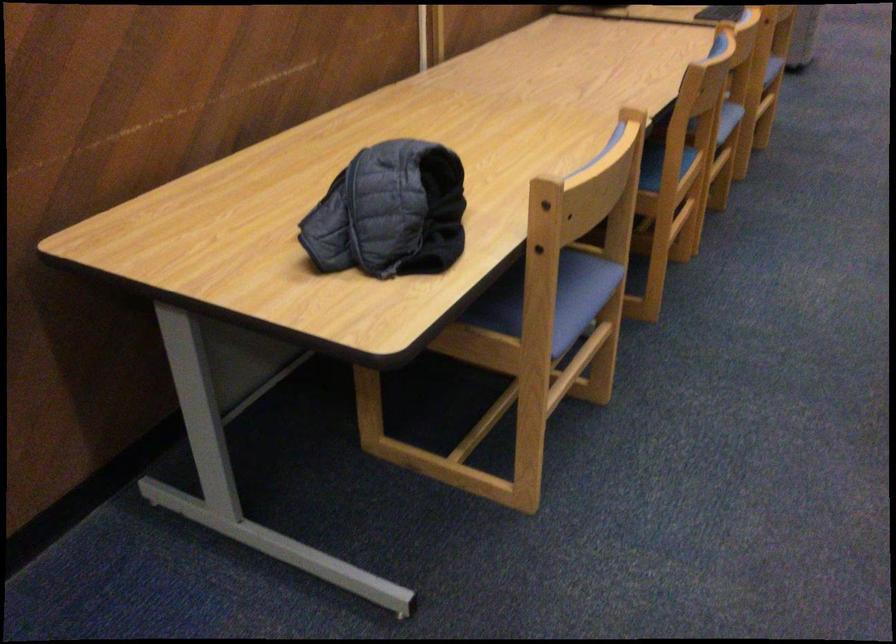
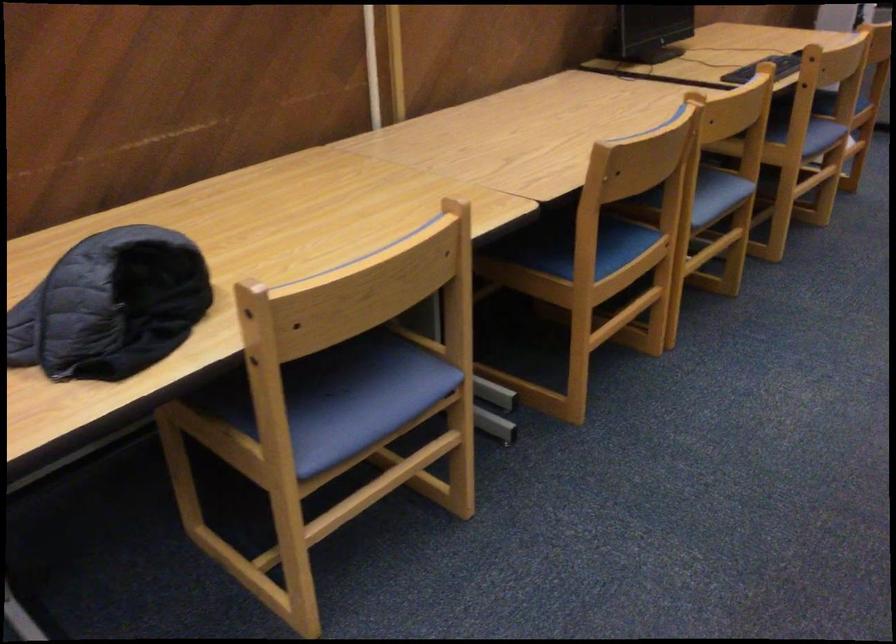
Where in the second image is the point corresponding to point (418, 202) from the first image?

(110, 305)